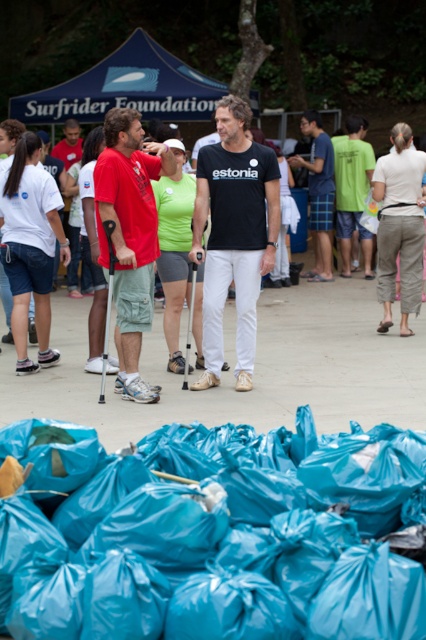
Question: Is blue plastic bags at lower center to the left of matte red shirt at left from the viewer's perspective?

Choices:
 (A) no
 (B) yes

Answer: (A)

Question: Which of these objects is positioned farthest from the matte red shirt at left?

Choices:
 (A) blue plastic bags at lower center
 (B) green cotton shirt at center

Answer: (B)

Question: Is black matte t-shirt at center wider than matte red shirt at left?

Choices:
 (A) no
 (B) yes

Answer: (B)

Question: Which object appears farthest from the camera in this image?

Choices:
 (A) green cotton shirt at center
 (B) plaid shorts at center
 (C) matte red shirt at left

Answer: (A)

Question: Among these objects, which one is farthest from the camera?

Choices:
 (A) white cotton shirt at center
 (B) matte red shirt at left
 (C) black matte t-shirt at center

Answer: (C)

Question: Does black matte t-shirt at center have a smaller size compared to green cotton shirt at center?

Choices:
 (A) yes
 (B) no

Answer: (A)